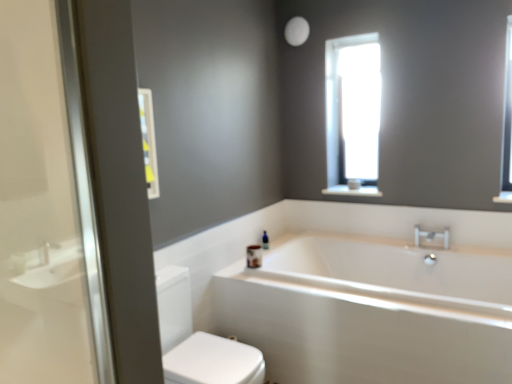
Question: From a real-world perspective, is white glossy toilet at lower left physically above silver metallic faucet at upper right?

Choices:
 (A) no
 (B) yes

Answer: (A)

Question: Can silver metallic faucet at upper right be found inside white glossy toilet at lower left?

Choices:
 (A) yes
 (B) no

Answer: (B)

Question: Considering the relative positions of white glossy toilet at lower left and silver metallic faucet at upper right in the image provided, is white glossy toilet at lower left to the left of silver metallic faucet at upper right from the viewer's perspective?

Choices:
 (A) yes
 (B) no

Answer: (A)

Question: Is white glossy toilet at lower left facing away from silver metallic faucet at upper right?

Choices:
 (A) no
 (B) yes

Answer: (A)

Question: From the image's perspective, would you say white glossy toilet at lower left is positioned over silver metallic faucet at upper right?

Choices:
 (A) no
 (B) yes

Answer: (A)

Question: Does white glossy toilet at lower left touch silver metallic faucet at upper right?

Choices:
 (A) yes
 (B) no

Answer: (B)

Question: Considering the relative sizes of white glossy bathtub at center and silver metallic faucet at upper right in the image provided, is white glossy bathtub at center shorter than silver metallic faucet at upper right?

Choices:
 (A) no
 (B) yes

Answer: (A)

Question: Can you confirm if white glossy bathtub at center is bigger than silver metallic faucet at upper right?

Choices:
 (A) yes
 (B) no

Answer: (A)

Question: Does white glossy bathtub at center lie behind silver metallic faucet at upper right?

Choices:
 (A) yes
 (B) no

Answer: (B)

Question: From the image's perspective, is white glossy bathtub at center below silver metallic faucet at upper right?

Choices:
 (A) no
 (B) yes

Answer: (B)

Question: Can you confirm if white glossy bathtub at center is thinner than silver metallic faucet at upper right?

Choices:
 (A) no
 (B) yes

Answer: (A)

Question: Does white glossy bathtub at center appear on the left side of silver metallic faucet at upper right?

Choices:
 (A) yes
 (B) no

Answer: (A)

Question: From a real-world perspective, is silver metallic faucet at upper right beneath white glossy bathtub at center?

Choices:
 (A) yes
 (B) no

Answer: (B)